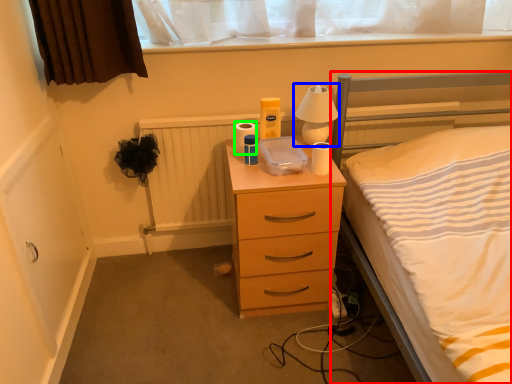
Question: Which is nearer to the bed (highlighted by a red box)? bedside lamp (highlighted by a blue box) or toilet paper (highlighted by a green box).

Choices:
 (A) bedside lamp
 (B) toilet paper

Answer: (A)